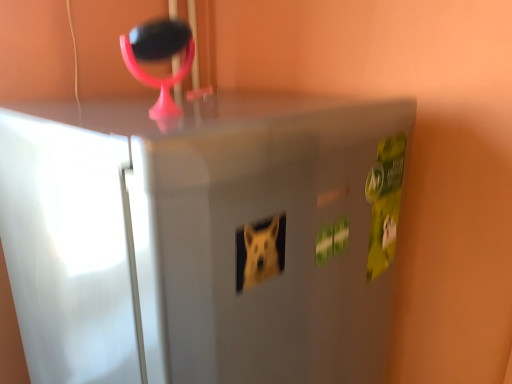
Question: Does pink plastic magnifying glass at upper center have a lesser height compared to satin silver fridge at center?

Choices:
 (A) yes
 (B) no

Answer: (A)

Question: Can you confirm if pink plastic magnifying glass at upper center is positioned to the left of satin silver fridge at center?

Choices:
 (A) yes
 (B) no

Answer: (A)

Question: Is pink plastic magnifying glass at upper center behind satin silver fridge at center?

Choices:
 (A) no
 (B) yes

Answer: (B)

Question: Is satin silver fridge at center completely or partially inside pink plastic magnifying glass at upper center?

Choices:
 (A) no
 (B) yes

Answer: (A)

Question: Can we say pink plastic magnifying glass at upper center lies outside satin silver fridge at center?

Choices:
 (A) no
 (B) yes

Answer: (B)

Question: From the image's perspective, is pink plastic magnifying glass at upper center beneath satin silver fridge at center?

Choices:
 (A) no
 (B) yes

Answer: (A)

Question: From a real-world perspective, is satin silver fridge at center below pink plastic magnifying glass at upper center?

Choices:
 (A) yes
 (B) no

Answer: (A)

Question: Would you say satin silver fridge at center is outside pink plastic magnifying glass at upper center?

Choices:
 (A) yes
 (B) no

Answer: (A)

Question: Would you say satin silver fridge at center is a long distance from pink plastic magnifying glass at upper center?

Choices:
 (A) yes
 (B) no

Answer: (B)

Question: Is satin silver fridge at center closer to camera compared to pink plastic magnifying glass at upper center?

Choices:
 (A) yes
 (B) no

Answer: (A)

Question: Can you confirm if satin silver fridge at center is shorter than pink plastic magnifying glass at upper center?

Choices:
 (A) yes
 (B) no

Answer: (B)

Question: From a real-world perspective, is satin silver fridge at center over pink plastic magnifying glass at upper center?

Choices:
 (A) yes
 (B) no

Answer: (B)

Question: Which is correct: pink plastic magnifying glass at upper center is inside satin silver fridge at center, or outside of it?

Choices:
 (A) outside
 (B) inside

Answer: (A)